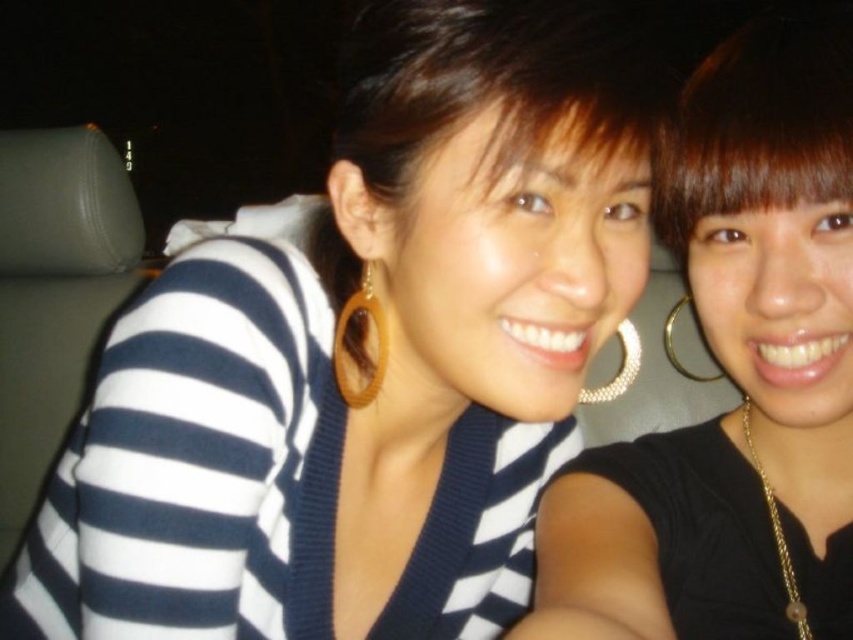
Between matte black sweater at center and brown hair at upper right, which one is positioned higher?

brown hair at upper right is above.

Does matte black sweater at center have a greater width compared to brown hair at upper right?

Correct, the width of matte black sweater at center exceeds that of brown hair at upper right.

Consider the image. Measure the distance between matte black sweater at center and camera.

matte black sweater at center is 39.78 centimeters away from camera.

Locate an element on the screen. This screenshot has height=640, width=853. matte black sweater at center is located at coordinates (735, 376).